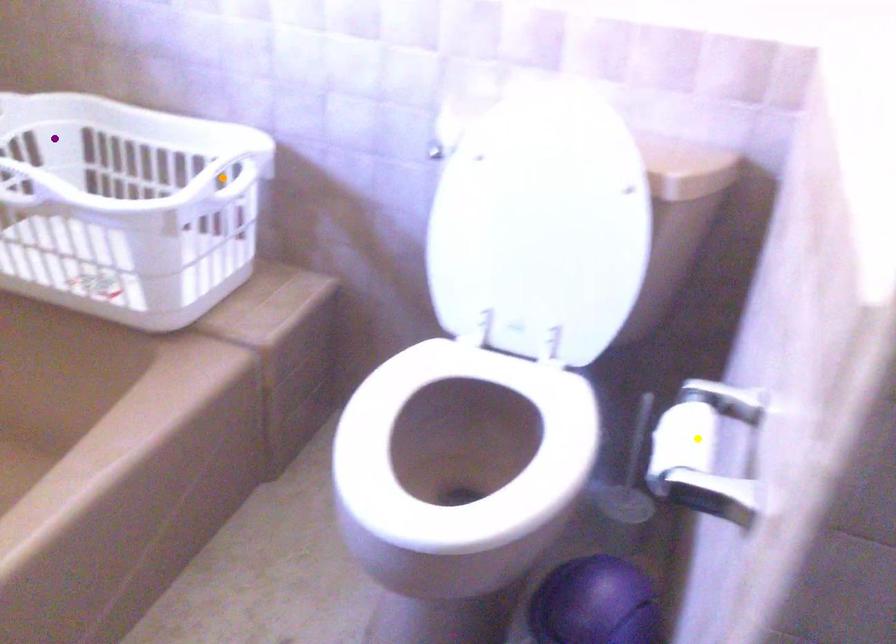
Order these from nearest to farthest:
orange point | purple point | yellow point

1. yellow point
2. orange point
3. purple point